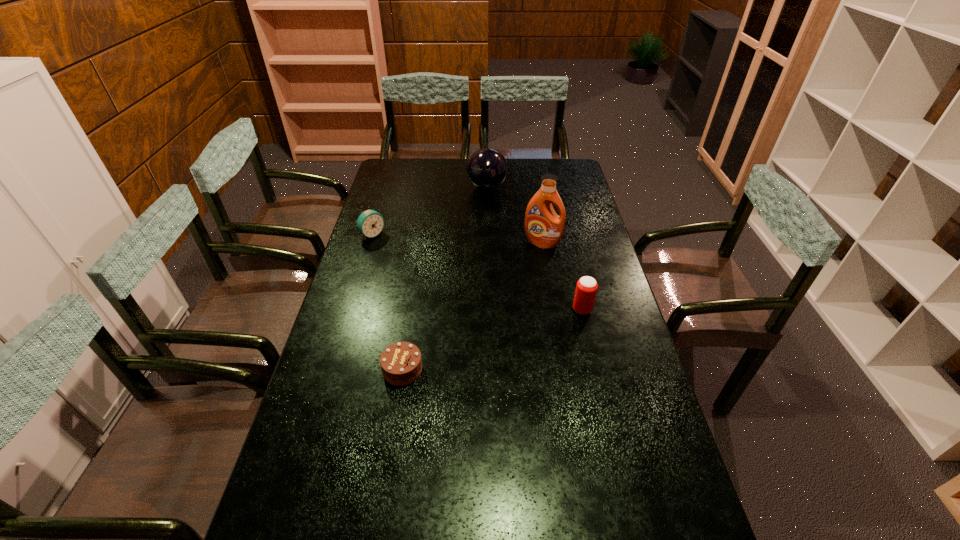
Find the location of a particular element. blank space located on the side of the farthest object with the finger holes is located at coordinates (488, 249).

Find the location of a particular element. vacant space situated 0.070m on the side of the farthest object with the finger holes is located at coordinates (488, 207).

At what (x,y) coordinates should I click in order to perform the action: click on free space located on the front-facing side of the alarm clock. Please return your answer as a coordinate pair (x, y). This screenshot has width=960, height=540. Looking at the image, I should click on (408, 260).

Image resolution: width=960 pixels, height=540 pixels. Find the location of `vacant position located on the front-facing side of the alarm clock`. vacant position located on the front-facing side of the alarm clock is located at coordinates (447, 288).

Find the location of a particular element. This screenshot has width=960, height=540. vacant area located 0.100m on the front-facing side of the alarm clock is located at coordinates (396, 252).

Identify the location of free spot located 0.210m on the front-facing side of the tallest object. (521, 285).

Find the location of a particular element. vacant area situated 0.170m on the front-facing side of the tallest object is located at coordinates (525, 278).

Find the location of a particular element. free region located 0.270m on the front-facing side of the tallest object is located at coordinates (516, 296).

The height and width of the screenshot is (540, 960). In order to click on object at the far edge in this screenshot , I will do `click(487, 168)`.

Find the location of a particular element. object present at the left edge is located at coordinates tap(370, 223).